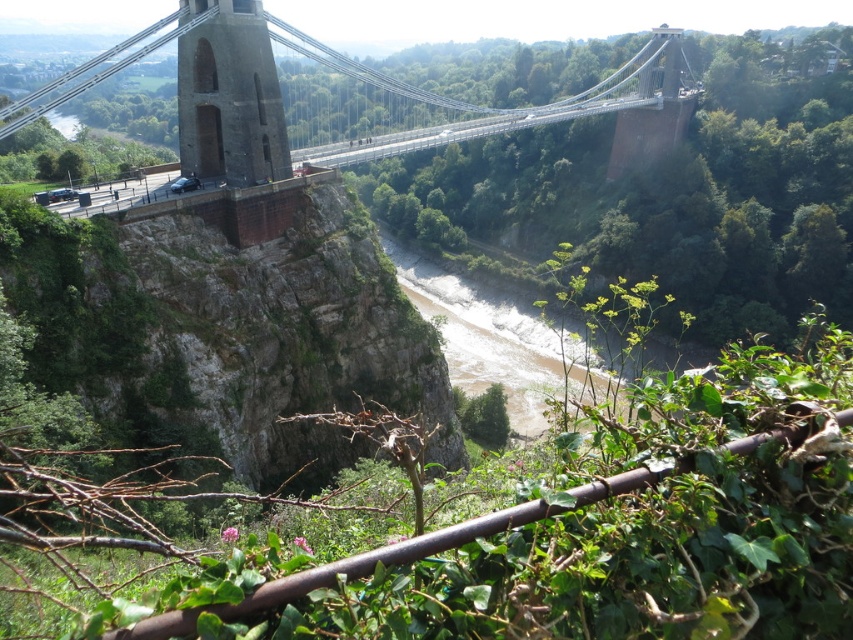
Can you confirm if concrete bridge at center is positioned to the left of brown sandy river at center?

Indeed, concrete bridge at center is positioned on the left side of brown sandy river at center.

Which of these two, concrete bridge at center or brown sandy river at center, stands shorter?

With less height is brown sandy river at center.

This screenshot has height=640, width=853. What are the coordinates of `concrete bridge at center` in the screenshot? It's located at (334, 70).

Does brown sandy river at center have a lesser height compared to dark gray stone tower at center?

Incorrect, brown sandy river at center's height does not fall short of dark gray stone tower at center's.

This screenshot has height=640, width=853. Find the location of `brown sandy river at center`. brown sandy river at center is located at coordinates click(490, 337).

What do you see at coordinates (334, 70) in the screenshot?
I see `concrete bridge at center` at bounding box center [334, 70].

Who is shorter, concrete bridge at center or dark gray stone tower at center?

dark gray stone tower at center is shorter.

Does point (412, 96) come behind point (218, 173)?

Yes, it is.

Where is `concrete bridge at center`? concrete bridge at center is located at coordinates (334, 70).